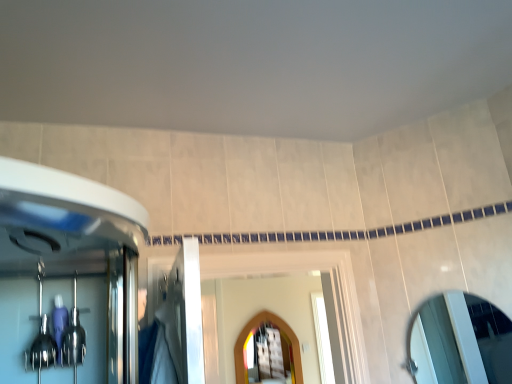
Question: Does point (247, 327) appear closer or farther from the camera than point (498, 355)?

Choices:
 (A) farther
 (B) closer

Answer: (A)

Question: Visually, is wooden arched mirror at center, which is the second mirror from front to back, positioned to the left or to the right of silver metallic mirror at right, the 1th mirror in the front-to-back sequence?

Choices:
 (A) right
 (B) left

Answer: (B)

Question: Is wooden arched mirror at center, arranged as the first mirror when viewed from the back, bigger or smaller than silver metallic mirror at right, which is the 1th mirror in top-to-bottom order?

Choices:
 (A) small
 (B) big

Answer: (B)

Question: From a real-world perspective, relative to wooden arched mirror at center, the 2th mirror from the right, is silver metallic mirror at right, acting as the first mirror starting from the right, vertically above or below?

Choices:
 (A) below
 (B) above

Answer: (B)

Question: Considering the positions of silver metallic mirror at right, the 2th mirror viewed from the left, and wooden arched mirror at center, which appears as the first mirror when ordered from the bottom, in the image, is silver metallic mirror at right, the 2th mirror viewed from the left, bigger or smaller than wooden arched mirror at center, which appears as the first mirror when ordered from the bottom,?

Choices:
 (A) small
 (B) big

Answer: (A)

Question: Considering the positions of silver metallic mirror at right, which ranks as the 2th mirror in bottom-to-top order, and wooden arched mirror at center, the second mirror from the top, in the image, is silver metallic mirror at right, which ranks as the 2th mirror in bottom-to-top order, taller or shorter than wooden arched mirror at center, the second mirror from the top,?

Choices:
 (A) short
 (B) tall

Answer: (A)

Question: Is point (484, 326) closer or farther from the camera than point (258, 322)?

Choices:
 (A) farther
 (B) closer

Answer: (B)